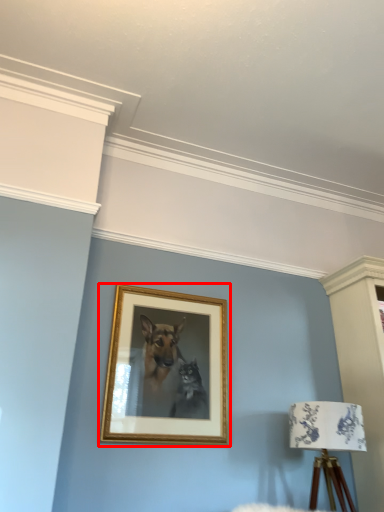
Question: Observing the image, what is the correct spatial positioning of picture frame (annotated by the red box) in reference to table lamp?

Choices:
 (A) right
 (B) left

Answer: (B)